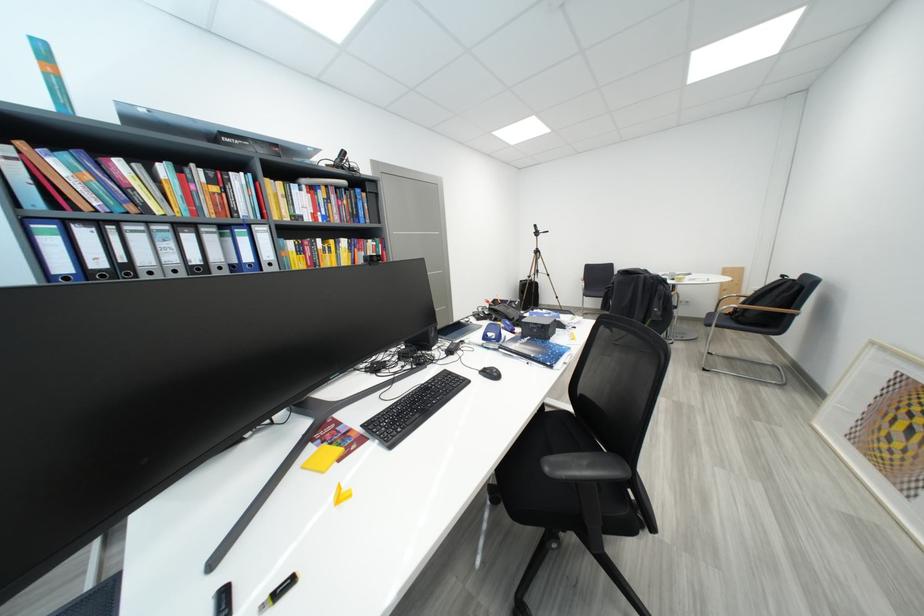
Which object does [496,330] point to?

It corresponds to the blue hole puncher in the image.